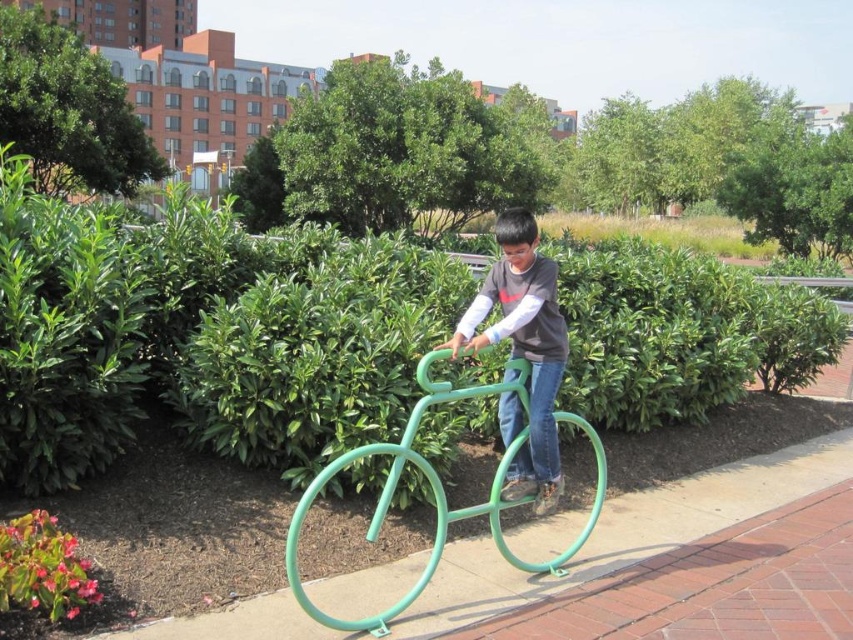
Question: Which of the following is the closest to the observer?

Choices:
 (A) green leafy bush at upper center
 (B) matte green bicycle at center
 (C) green matte bicycle at center

Answer: (C)

Question: Can you confirm if green leafy bush at upper center is positioned above matte green bicycle at center?

Choices:
 (A) yes
 (B) no

Answer: (A)

Question: Does matte green bicycle at center appear under green matte bicycle at center?

Choices:
 (A) no
 (B) yes

Answer: (A)

Question: Based on their relative distances, which object is farther from the green leafy bush at upper left?

Choices:
 (A) matte green bicycle at center
 (B) green matte bicycle at center

Answer: (B)

Question: Which object appears closest to the camera in this image?

Choices:
 (A) green leafy bush at upper left
 (B) matte green bicycle at center
 (C) green matte bicycle at center

Answer: (C)

Question: Is green leafy bush at upper center thinner than green matte bicycle at center?

Choices:
 (A) yes
 (B) no

Answer: (B)